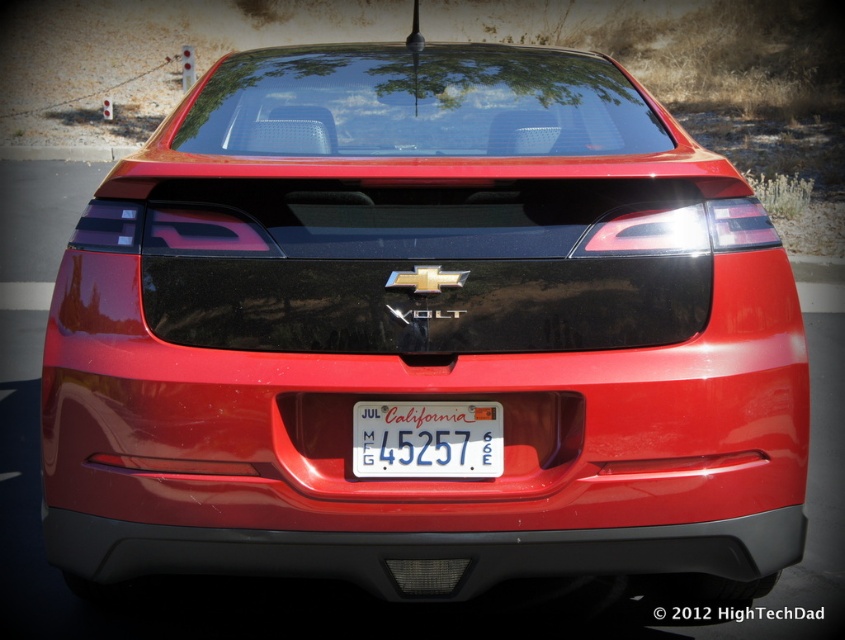
Question: Can you confirm if matte black bumper at lower center is positioned below white plastic license plate at center?

Choices:
 (A) no
 (B) yes

Answer: (B)

Question: Among these objects, which one is nearest to the camera?

Choices:
 (A) white plastic license plate at center
 (B) matte black bumper at lower center

Answer: (B)

Question: Which point is farther from the camera taking this photo?

Choices:
 (A) (462, 452)
 (B) (766, 570)

Answer: (B)

Question: Can you confirm if matte black bumper at lower center is positioned to the right of white plastic license plate at center?

Choices:
 (A) yes
 (B) no

Answer: (B)

Question: Can you confirm if matte black bumper at lower center is wider than white plastic license plate at center?

Choices:
 (A) no
 (B) yes

Answer: (B)